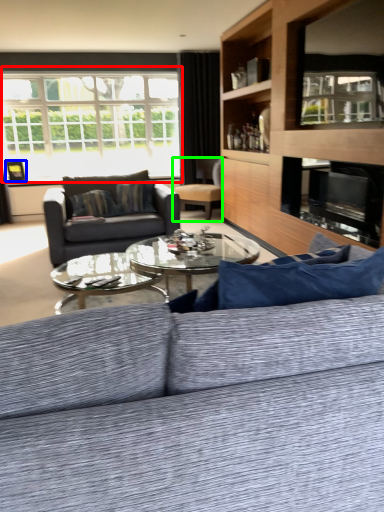
Question: Based on their relative distances, which object is farther from window (highlighted by a red box)? Choose from picture frame (highlighted by a blue box) and chair (highlighted by a green box).

Choices:
 (A) picture frame
 (B) chair

Answer: (B)